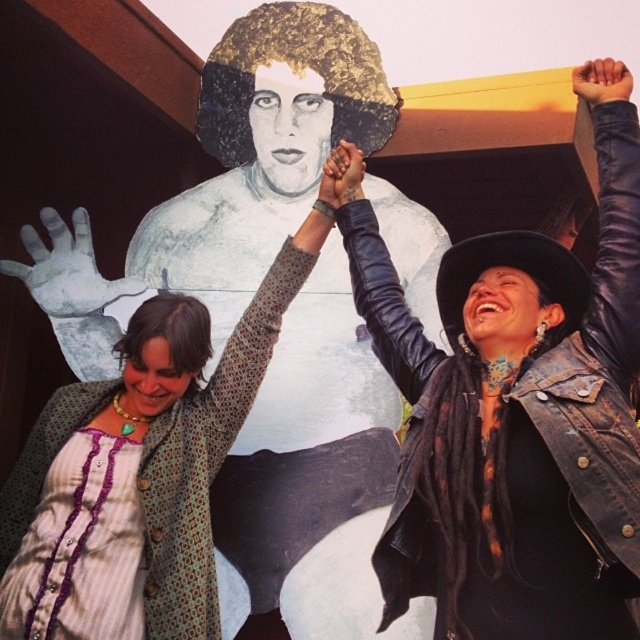
Which is in front, point (456, 433) or point (321, 180)?

Point (456, 433)

Is leather jacket at upper right bigger than tattooed skin at center?

Yes, leather jacket at upper right is bigger than tattooed skin at center.

Identify the location of leather jacket at upper right. The width and height of the screenshot is (640, 640). click(x=516, y=420).

You are a GUI agent. You are given a task and a screenshot of the screen. Output one action in this format:
    pyautogui.click(x=<x>, y=<y>)
    Task: Click on the leather jacket at upper right
    The image size is (640, 640).
    Given the screenshot: What is the action you would take?
    pyautogui.click(x=516, y=420)

Can you confirm if leather jacket at upper right is positioned to the left of smooth leather hand at upper right?

Indeed, leather jacket at upper right is positioned on the left side of smooth leather hand at upper right.

Between leather jacket at upper right and smooth leather hand at upper right, which one appears on the left side from the viewer's perspective?

Answer: leather jacket at upper right

Does point (371, 317) come in front of point (605, 83)?

No, (371, 317) is behind (605, 83).

Find the location of a particular element. leather jacket at upper right is located at coordinates (516, 420).

Is patterned fabric dress at upper left positioned behind smooth leather hand at upper right?

No, it is in front of smooth leather hand at upper right.

Find the location of `patterned fabric dress at upper left`. patterned fabric dress at upper left is located at coordinates (253, 342).